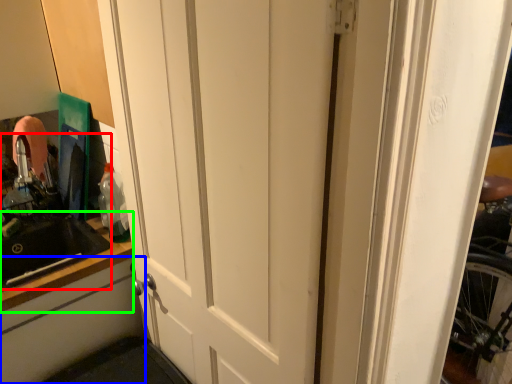
Question: Based on their relative distances, which object is farther from sink (highlighted by a red box)? Choose from cabinetry (highlighted by a blue box) and counter top (highlighted by a green box).

Choices:
 (A) cabinetry
 (B) counter top

Answer: (A)